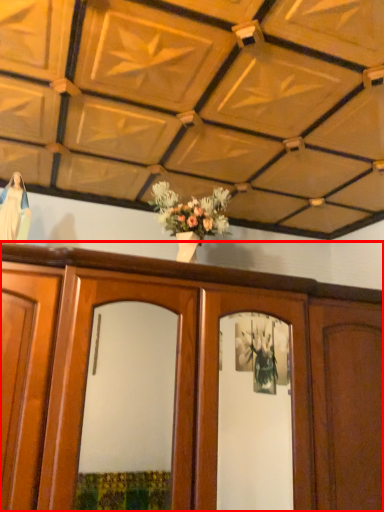
Question: Considering the relative positions of cabinetry (annotated by the red box) and robe in the image provided, where is cabinetry (annotated by the red box) located with respect to the staircase?

Choices:
 (A) right
 (B) left

Answer: (A)